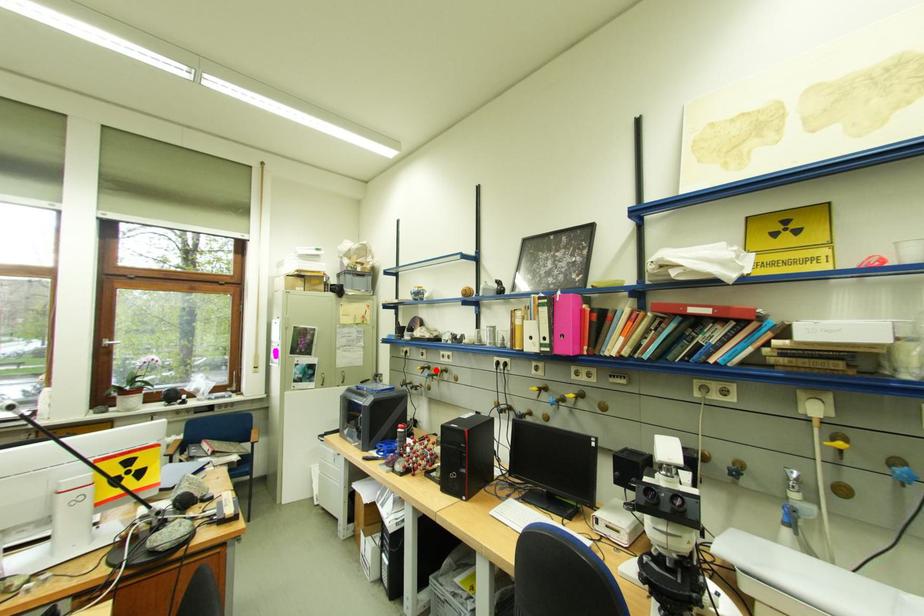
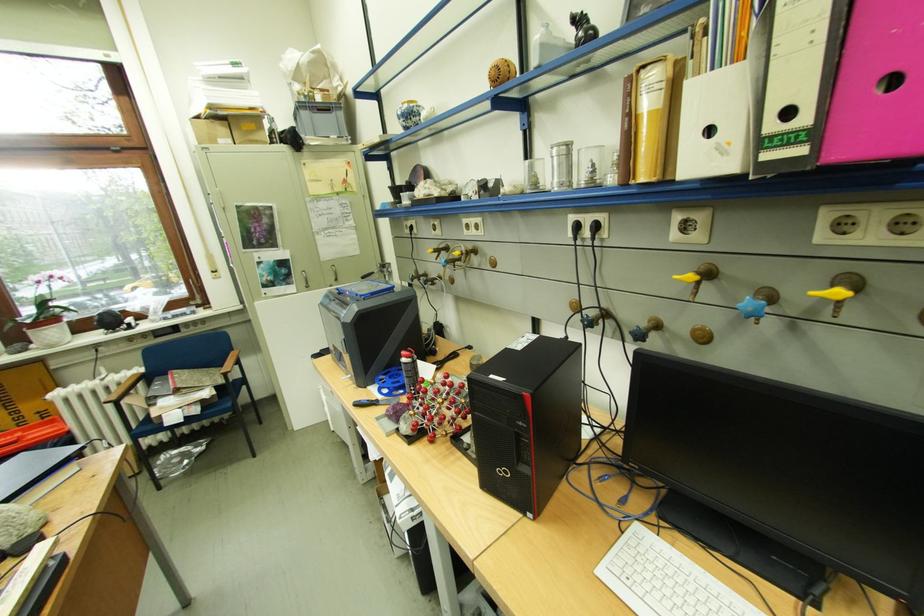
Question: A red point is marked in image1. In image2, is the corresponding 3D point closer to the camera or farther? Reply with the corresponding letter.

Choices:
 (A) The corresponding 3D point is closer.
 (B) The corresponding 3D point is farther.

Answer: (A)